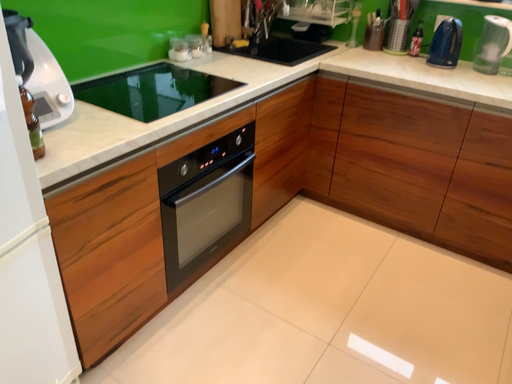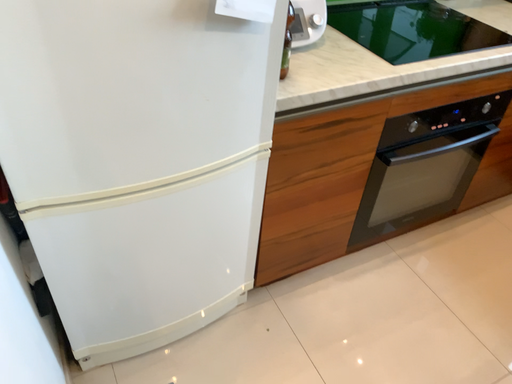
Question: How did the camera likely rotate when shooting the video?

Choices:
 (A) rotated left
 (B) rotated right

Answer: (A)